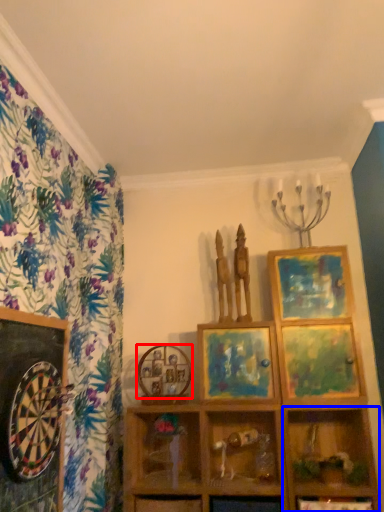
Question: Which of the following is the farthest to the observer, picture frame (highlighted by a red box) or shelf (highlighted by a blue box)?

Choices:
 (A) picture frame
 (B) shelf

Answer: (A)